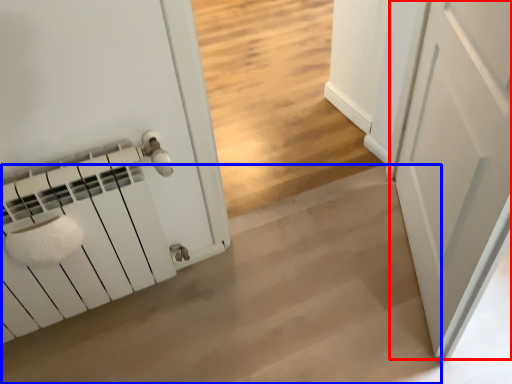
Question: Among these objects, which one is nearest to the camera, door (highlighted by a red box) or concrete (highlighted by a blue box)?

Choices:
 (A) door
 (B) concrete

Answer: (A)